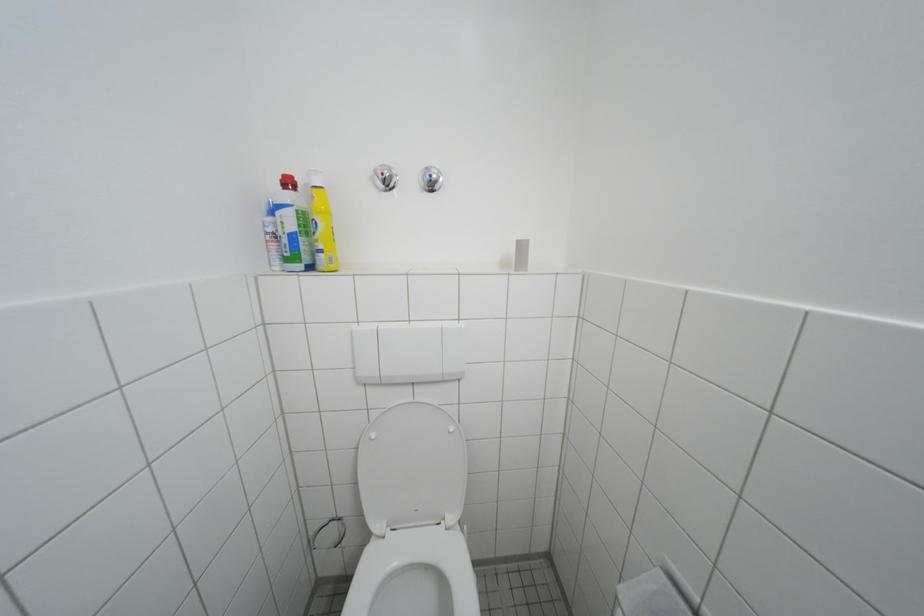
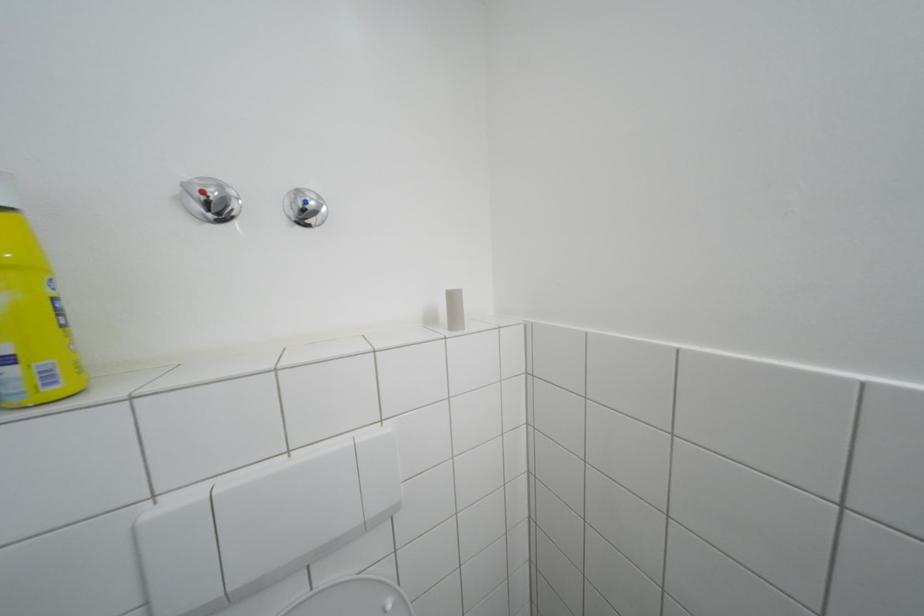
Question: The images are taken continuously from a first-person perspective. In which direction is your viewpoint rotating?

Choices:
 (A) Left
 (B) Right
 (C) Up
 (D) Down

Answer: (B)